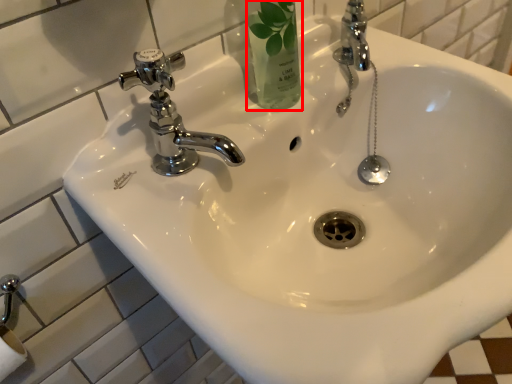
Question: From the image's perspective, where is mouthwash (annotated by the red box) located relative to tap?

Choices:
 (A) below
 (B) above

Answer: (B)